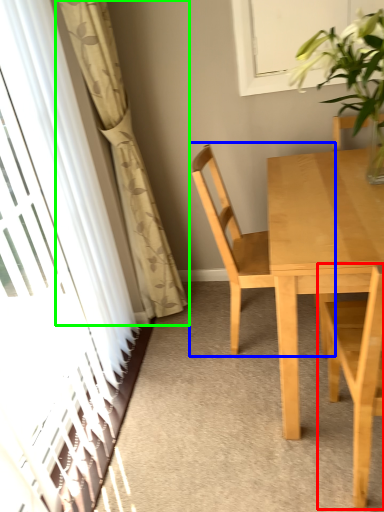
Question: Estimate the real-world distances between objects in this image. Which object is farther from chair (highlighted by a red box), chair (highlighted by a blue box) or curtain (highlighted by a green box)?

Choices:
 (A) chair
 (B) curtain

Answer: (B)